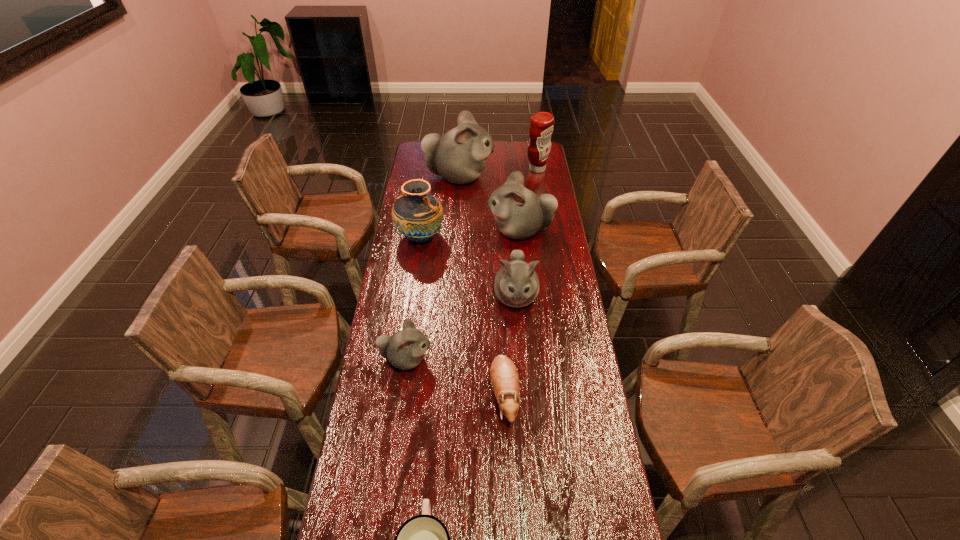
Image resolution: width=960 pixels, height=540 pixels. Find the location of `free space that is in between the third farthest hamster and the shortest hamster`. free space that is in between the third farthest hamster and the shortest hamster is located at coordinates (510, 345).

Where is `free space between the red condiment and the fourth tallest hamster`? The image size is (960, 540). free space between the red condiment and the fourth tallest hamster is located at coordinates (471, 264).

The height and width of the screenshot is (540, 960). What are the coordinates of `object that is the sixth closest to the shortest hamster` in the screenshot? It's located at (459, 156).

This screenshot has width=960, height=540. In order to click on object that is the third closest one to the brown hamster in this screenshot , I will do click(x=423, y=539).

Image resolution: width=960 pixels, height=540 pixels. In order to click on hamster that stands as the second closest to the red condiment in this screenshot , I will do `click(519, 213)`.

Locate an element on the screen. This screenshot has height=540, width=960. the fifth closest hamster relative to the red condiment is located at coordinates [504, 377].

Where is `white hamster that can be found as the fourth closest to the pottery`? The image size is (960, 540). white hamster that can be found as the fourth closest to the pottery is located at coordinates (405, 349).

At what (x,y) coordinates should I click in order to perform the action: click on the second closest white hamster to the third nearest white hamster. Please return your answer as a coordinate pair (x, y). This screenshot has width=960, height=540. Looking at the image, I should click on (459, 156).

The image size is (960, 540). I want to click on free location that satisfies the following two spatial constraints: 1. on the front side of the red condiment; 2. on the face of the farthest hamster, so click(539, 177).

The height and width of the screenshot is (540, 960). I want to click on vacant space that satisfies the following two spatial constraints: 1. on the face of the second tallest hamster; 2. on the face of the fourth shortest object, so point(527,296).